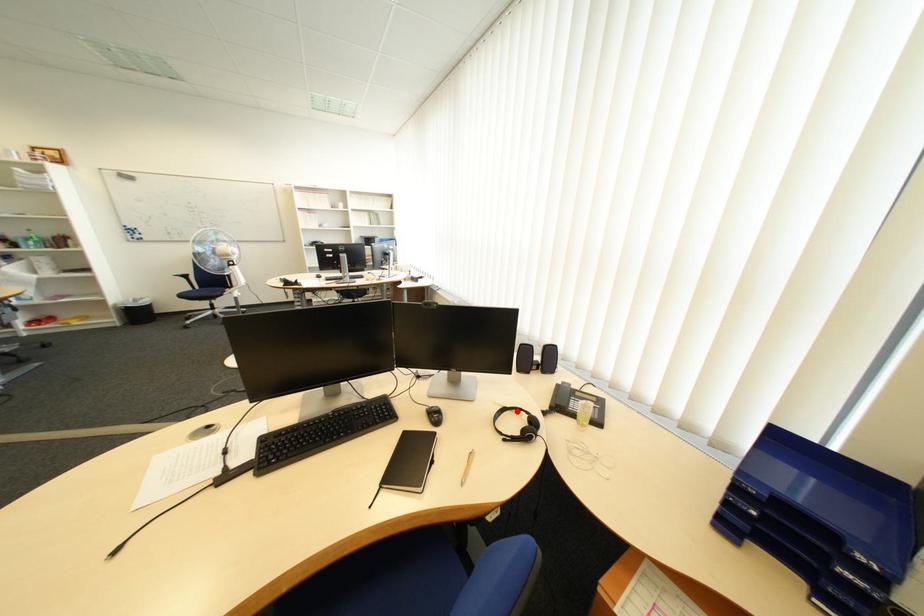
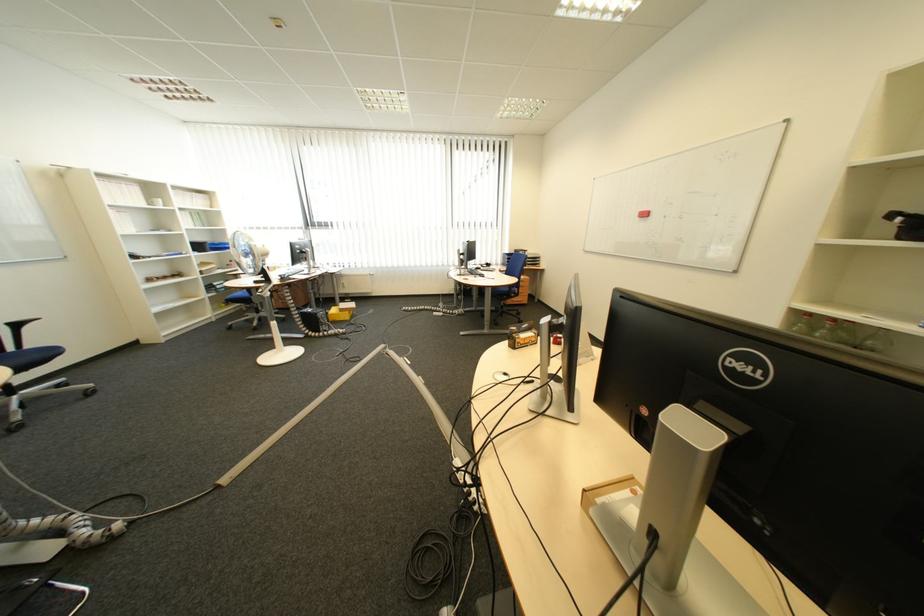
Question: I am providing you with two images of the same scene from different viewpoints. A red point is marked on the first image. At the location where the point appears in image 1, is it still visible in image 2?

Choices:
 (A) Yes
 (B) No

Answer: (B)